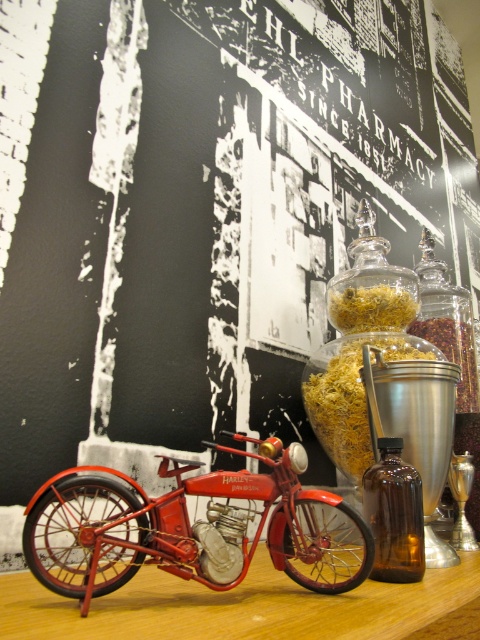
You are a pharmacist organizing items on a shelf. You have a translucent glass jar at center and a brown glass bottle at right. Which container is shorter?

The translucent glass jar at center is shorter than the brown glass bottle at right.

You are a pharmacist organizing items on the countertop. You need to place both the translucent glass jar at center and the brown glass bottle at right. Which one requires a wider space on the countertop?

The translucent glass jar at center requires a wider space on the countertop because its width surpasses that of the brown glass bottle at right.

You are a pharmacist organizing items on a shelf. You have a brown glass bottle at lower right and a brown granular spice at center right. Which item is placed higher up on the shelf?

The brown granular spice at center right is placed higher up on the shelf than the brown glass bottle at lower right.